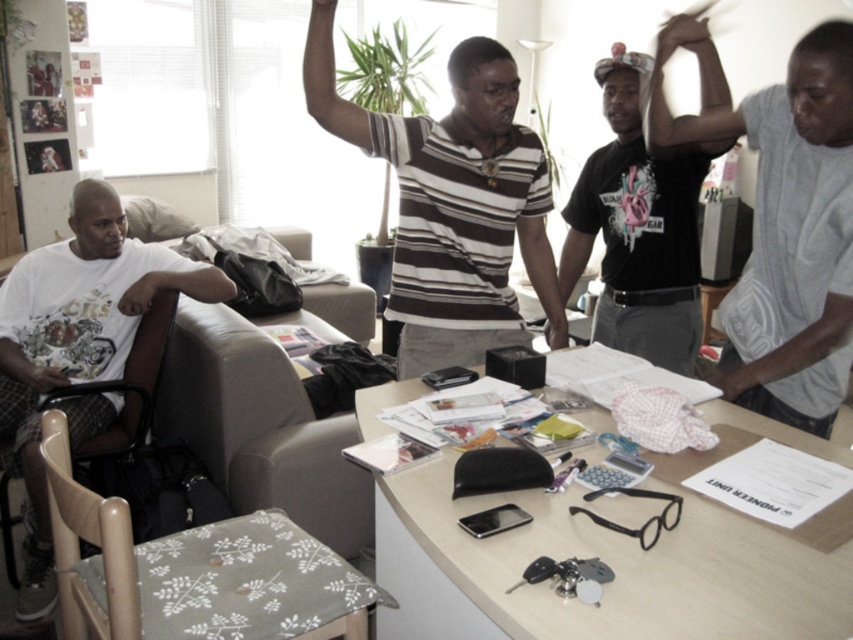
You are standing at the origin point of the coordinate system in the room. The light beige laminate table at center is located at coordinates 0.875, 0.708. If you want to walk directly to the table, which direction should you head towards?

You should head towards the coordinates (602, 560) to reach the light beige laminate table at center.

You are a delivery person who needs to place a small package on the table. The package is 40 centimeters long. Can you slide it from the gray fabric armchair at lower left to the light beige laminate table at center without moving either object?

The distance between the light beige laminate table at center and the gray fabric armchair at lower left is 39.65 centimeters. Since the package is 40 centimeters long, it would not fit between them without moving either object.

Looking at this image, you are a tailor measuring shirts for alteration. You have a measuring tape that can only extend up to 60 centimeters. Can you measure the distance between the striped cotton shirt at center and the gray cotton shirt at right without moving either shirt?

The striped cotton shirt at center and gray cotton shirt at right are 59.39 centimeters apart. Since your measuring tape can extend up to 60 centimeters, you can measure the distance between them without moving either shirt.